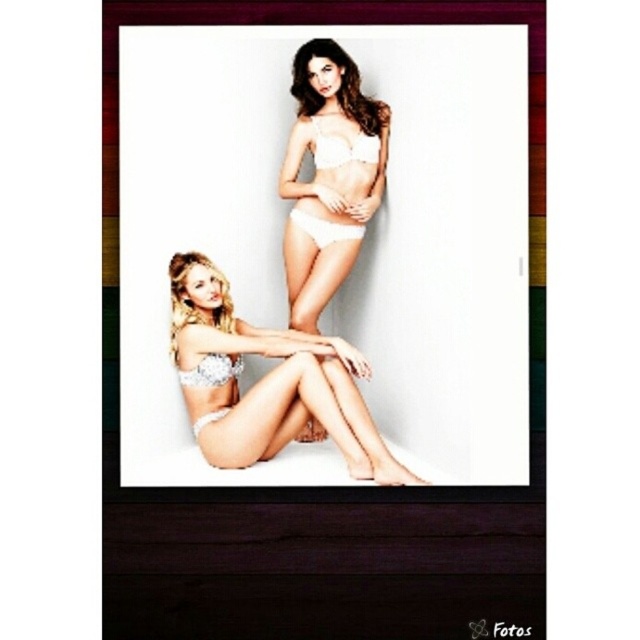
Consider the image. You are a photographer setting up a photoshoot with two models. You have a white satin lingerie at center and a white matte bra at upper center. The backdrop is plain white. You want to ensure that the taller item is placed in the center of the frame. Which item should you position at the center?

The white satin lingerie at center is much taller than the white matte bra at upper center, so you should position the white satin lingerie at center at the center of the frame to highlight its height.

You are a photographer arranging two pieces of lingerie for a photoshoot. You have the white satin lingerie at center and the white matte bra at upper center. Based on their positions and materials, which one do you think will cast a larger shadow?

The white satin lingerie at center is wider than the white matte bra at upper center, so it will cast a larger shadow.

You are a photographer setting up a shoot. You have two items to place in the scene described. The items are the white matte bikini at upper center and the white lace underwear at upper center. Based on the scene description, which item should you place closer to the camera to match the image?

The white matte bikini at upper center should be placed closer to the camera since it is closer to the viewer than the white lace underwear at upper center according to the description.